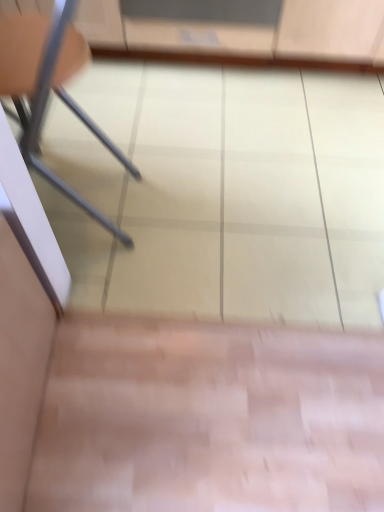
This screenshot has height=512, width=384. What do you see at coordinates (42, 118) in the screenshot? I see `metallic gray chair at left` at bounding box center [42, 118].

The image size is (384, 512). I want to click on metallic gray chair at left, so click(x=42, y=118).

Describe the element at coordinates (203, 27) in the screenshot. The height and width of the screenshot is (512, 384). I see `transparent plastic screen door at upper center` at that location.

The image size is (384, 512). I want to click on transparent plastic screen door at upper center, so click(203, 27).

Find the location of a particular element. The height and width of the screenshot is (512, 384). metallic gray chair at left is located at coordinates (42, 118).

In the scene shown: Considering the relative positions of transparent plastic screen door at upper center and metallic gray chair at left in the image provided, is transparent plastic screen door at upper center to the left or to the right of metallic gray chair at left?

Clearly, transparent plastic screen door at upper center is on the right of metallic gray chair at left in the image.

Which object is further away from the camera taking this photo, transparent plastic screen door at upper center or metallic gray chair at left?

transparent plastic screen door at upper center.

Is point (144, 39) more distant than point (53, 175)?

Yes, point (144, 39) is farther from viewer.

Consider the image. From the image's perspective, is transparent plastic screen door at upper center on metallic gray chair at left?

Yes, from the image's perspective, transparent plastic screen door at upper center is on top of metallic gray chair at left.

From a real-world perspective, between transparent plastic screen door at upper center and metallic gray chair at left, who is vertically higher?

metallic gray chair at left is physically above.

Can you confirm if transparent plastic screen door at upper center is thinner than metallic gray chair at left?

No, transparent plastic screen door at upper center is not thinner than metallic gray chair at left.

Considering the sizes of objects transparent plastic screen door at upper center and metallic gray chair at left in the image provided, who is taller, transparent plastic screen door at upper center or metallic gray chair at left?

Standing taller between the two is metallic gray chair at left.

Who is bigger, transparent plastic screen door at upper center or metallic gray chair at left?

With larger size is metallic gray chair at left.

Is transparent plastic screen door at upper center not within metallic gray chair at left?

Yes.

Can you see transparent plastic screen door at upper center touching metallic gray chair at left?

They are not placed beside each other.

Is transparent plastic screen door at upper center turned away from metallic gray chair at left?

No, transparent plastic screen door at upper center is not facing the opposite direction of metallic gray chair at left.

Measure the distance between transparent plastic screen door at upper center and metallic gray chair at left.

65.11 centimeters.

In order to click on screen door below the metallic gray chair at left (from a real-world perspective) in this screenshot , I will do `click(203, 27)`.

Does metallic gray chair at left appear on the left side of transparent plastic screen door at upper center?

→ Indeed, metallic gray chair at left is positioned on the left side of transparent plastic screen door at upper center.

Is metallic gray chair at left positioned in front of transparent plastic screen door at upper center?

Yes, it is in front of transparent plastic screen door at upper center.

Which is less distant, (87, 203) or (236, 36)?

Clearly, point (87, 203) is closer to the camera than point (236, 36).

From the image's perspective, does metallic gray chair at left appear lower than transparent plastic screen door at upper center?

Indeed, from the image's perspective, metallic gray chair at left is shown beneath transparent plastic screen door at upper center.

Consider the image. From a real-world perspective, relative to transparent plastic screen door at upper center, is metallic gray chair at left vertically above or below?

metallic gray chair at left is situated higher than transparent plastic screen door at upper center in the real world.

In terms of width, does metallic gray chair at left look wider or thinner when compared to transparent plastic screen door at upper center?

Clearly, metallic gray chair at left has less width compared to transparent plastic screen door at upper center.

Who is shorter, metallic gray chair at left or transparent plastic screen door at upper center?

transparent plastic screen door at upper center is shorter.

In terms of size, does metallic gray chair at left appear bigger or smaller than transparent plastic screen door at upper center?

Considering their sizes, metallic gray chair at left takes up more space than transparent plastic screen door at upper center.

Is metallic gray chair at left surrounding transparent plastic screen door at upper center?

No, transparent plastic screen door at upper center is not surrounded by metallic gray chair at left.

Is metallic gray chair at left positioned far away from transparent plastic screen door at upper center?

No, metallic gray chair at left is not far from transparent plastic screen door at upper center.

Based on the photo, is metallic gray chair at left oriented towards transparent plastic screen door at upper center?

No, metallic gray chair at left is not facing towards transparent plastic screen door at upper center.

Looking at this image, can you tell me how much metallic gray chair at left and transparent plastic screen door at upper center differ in facing direction?

The angle between the facing direction of metallic gray chair at left and the facing direction of transparent plastic screen door at upper center is 90.6 degrees.

I want to click on chair that appears in front of the transparent plastic screen door at upper center, so click(x=42, y=118).

Identify the location of screen door below the metallic gray chair at left (from a real-world perspective). (203, 27).

This screenshot has height=512, width=384. In order to click on chair below the transparent plastic screen door at upper center (from the image's perspective) in this screenshot , I will do `click(42, 118)`.